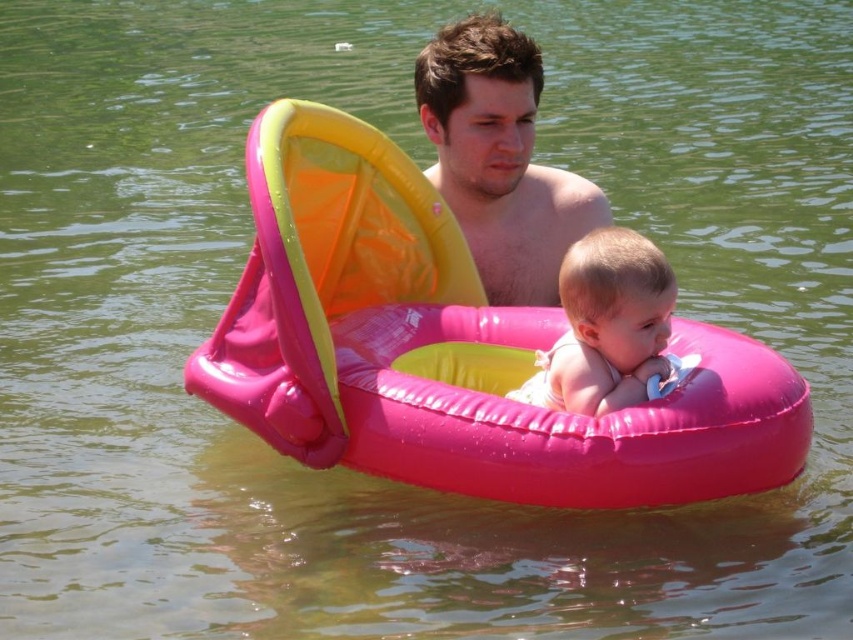
What can be seen at the point with coordinates (x=498, y=157) in the image?

At the point with coordinates (x=498, y=157), there is shiny brown hair at upper center.

You are a lifeguard on duty at the pool. You see the pink rubber baby float at center and the shiny skin at center. The pool has a safety rule that swimmers must stay at least 5 meters apart. Are the two objects violating the safety rule?

The distance between the pink rubber baby float at center and the shiny skin at center is 4.94 meters, which is less than the required 5 meters. Therefore, they are violating the safety rule.